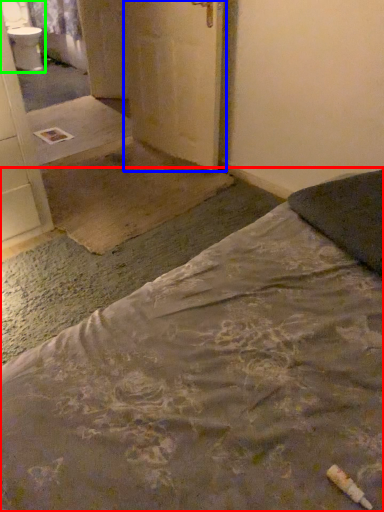
Question: Considering the real-world distances, which object is closest to bed (highlighted by a red box)? door (highlighted by a blue box) or sink (highlighted by a green box).

Choices:
 (A) door
 (B) sink

Answer: (A)